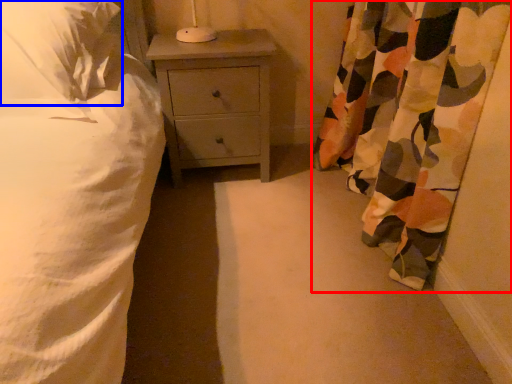
Question: Which object appears closest to the camera in this image, curtain (highlighted by a red box) or pillow (highlighted by a blue box)?

Choices:
 (A) curtain
 (B) pillow

Answer: (A)